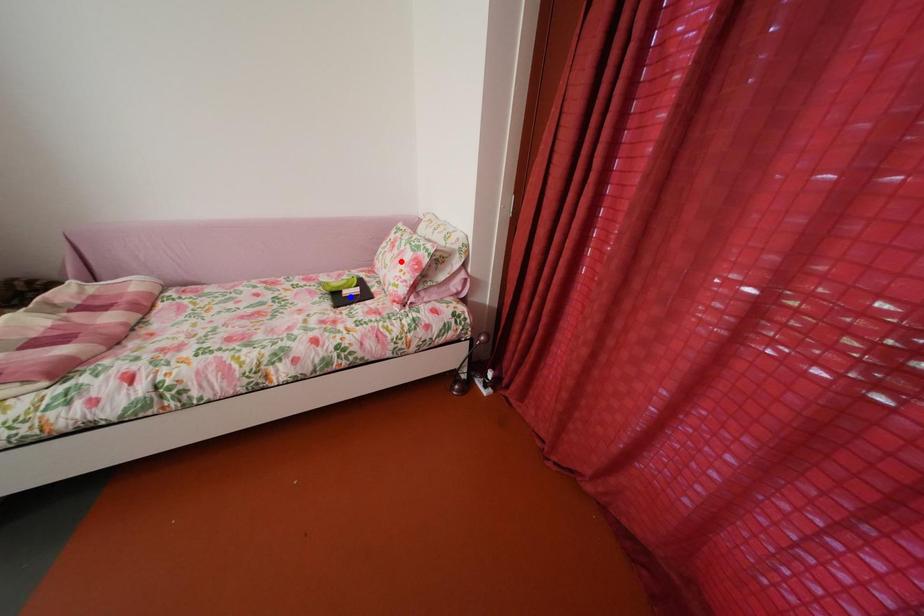
Question: Two points are marked on the image. Which point is closer to the camera?

Choices:
 (A) Blue point is closer.
 (B) Red point is closer.

Answer: (B)